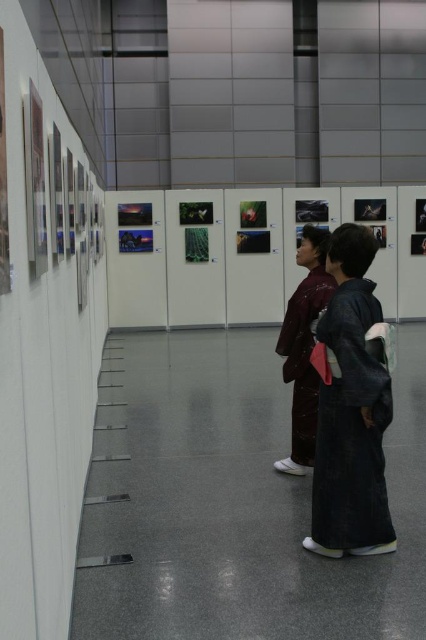
You are an art curator arranging two kimonos in the center of an art gallery. The dark gray kimono at center and the matte brown kimono at center need to be displayed such that the taller kimono is placed behind the shorter one to create a layered effect. Which kimono should be placed in the back?

The matte brown kimono at center should be placed in the back because it has a greater height than the dark gray kimono at center.